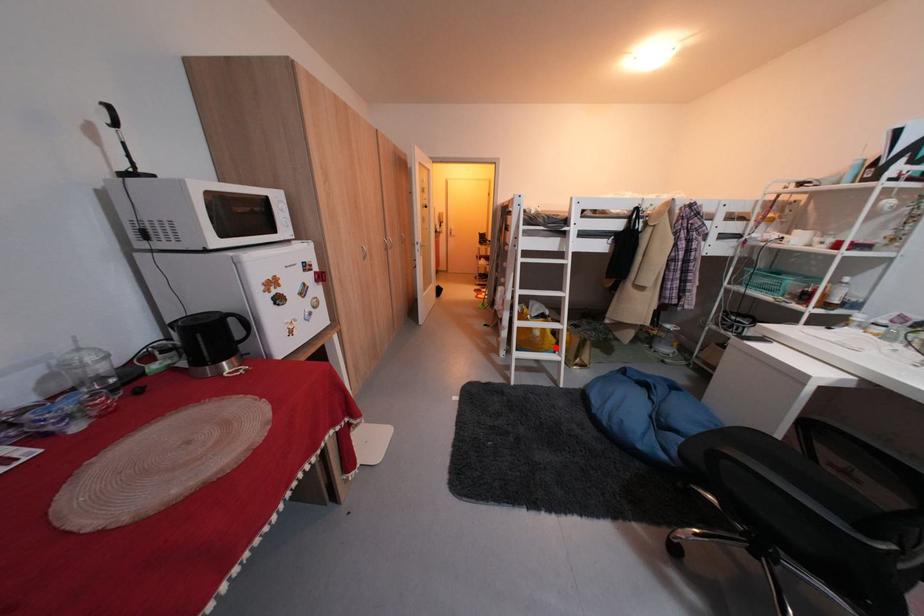
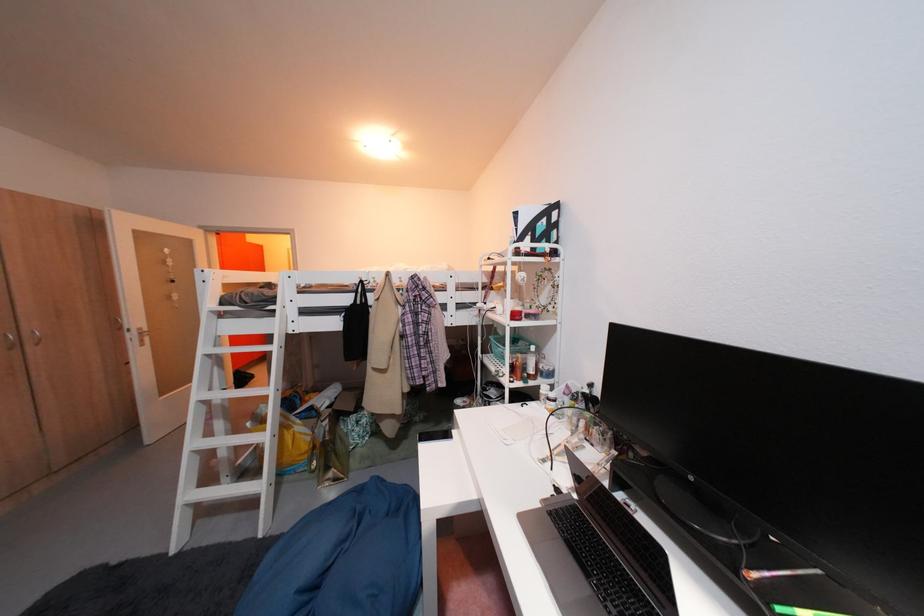
Question: I am providing you with two images of the same scene from different viewpoints. Image1 has a red point marked. In image2, the corresponding 3D location appears at what relative position? Reply with the corresponding letter.

Choices:
 (A) Closer
 (B) Farther

Answer: (B)